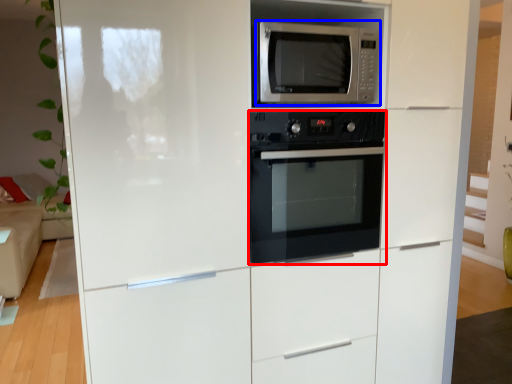
Question: Among these objects, which one is farthest to the camera, oven (highlighted by a red box) or microwave oven (highlighted by a blue box)?

Choices:
 (A) oven
 (B) microwave oven

Answer: (A)